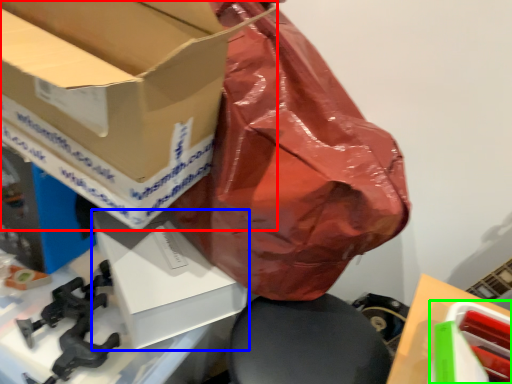
Question: Which is farther away from box (highlighted by a red box)? box (highlighted by a blue box) or box (highlighted by a green box)?

Choices:
 (A) box
 (B) box

Answer: (B)